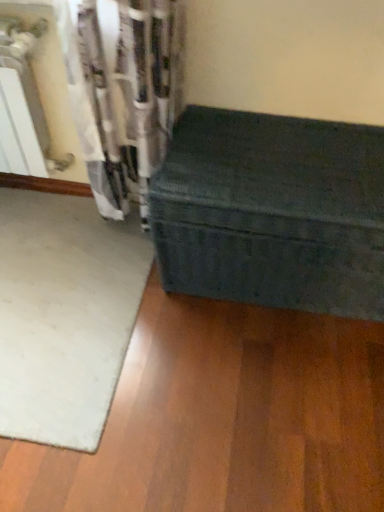
Question: Is green fabric trunk at lower right bigger than white soft mat at lower left?

Choices:
 (A) yes
 (B) no

Answer: (A)

Question: From a real-world perspective, is green fabric trunk at lower right on top of white soft mat at lower left?

Choices:
 (A) no
 (B) yes

Answer: (B)

Question: From the image's perspective, is green fabric trunk at lower right beneath white soft mat at lower left?

Choices:
 (A) yes
 (B) no

Answer: (B)

Question: Is green fabric trunk at lower right not within white soft mat at lower left?

Choices:
 (A) no
 (B) yes

Answer: (B)

Question: Does green fabric trunk at lower right contain white soft mat at lower left?

Choices:
 (A) yes
 (B) no

Answer: (B)

Question: Does green fabric trunk at lower right come behind white soft mat at lower left?

Choices:
 (A) no
 (B) yes

Answer: (A)

Question: Is white soft mat at lower left to the right of green fabric trunk at lower right from the viewer's perspective?

Choices:
 (A) no
 (B) yes

Answer: (A)

Question: Considering the relative sizes of white soft mat at lower left and green fabric trunk at lower right in the image provided, is white soft mat at lower left thinner than green fabric trunk at lower right?

Choices:
 (A) yes
 (B) no

Answer: (B)

Question: From the image's perspective, is white soft mat at lower left below green fabric trunk at lower right?

Choices:
 (A) no
 (B) yes

Answer: (B)

Question: Is white soft mat at lower left far away from green fabric trunk at lower right?

Choices:
 (A) no
 (B) yes

Answer: (A)

Question: Is white soft mat at lower left facing towards green fabric trunk at lower right?

Choices:
 (A) yes
 (B) no

Answer: (B)

Question: Is white soft mat at lower left in front of green fabric trunk at lower right?

Choices:
 (A) yes
 (B) no

Answer: (B)

Question: Considering the positions of green fabric trunk at lower right and white soft mat at lower left in the image, is green fabric trunk at lower right wider or thinner than white soft mat at lower left?

Choices:
 (A) wide
 (B) thin

Answer: (B)